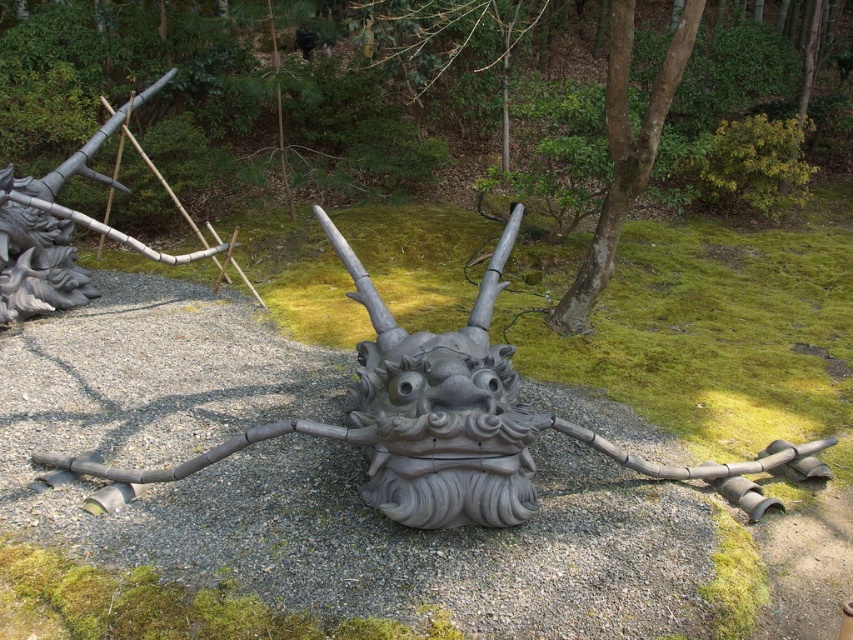
Question: Does brushed metal dragon head at left appear over brown smooth tree at center?

Choices:
 (A) yes
 (B) no

Answer: (A)

Question: Which point appears farthest from the camera in this image?

Choices:
 (A) (48, 211)
 (B) (643, 145)

Answer: (A)

Question: Is brushed metal dragon head at left smaller than brown smooth tree at center?

Choices:
 (A) no
 (B) yes

Answer: (A)

Question: Does brushed metal dragon head at left have a lesser width compared to brown smooth tree at center?

Choices:
 (A) yes
 (B) no

Answer: (B)

Question: Which point is farther to the camera?

Choices:
 (A) (585, 264)
 (B) (68, 262)

Answer: (B)

Question: Which of the following is the farthest from the observer?

Choices:
 (A) (33, 300)
 (B) (604, 106)

Answer: (B)